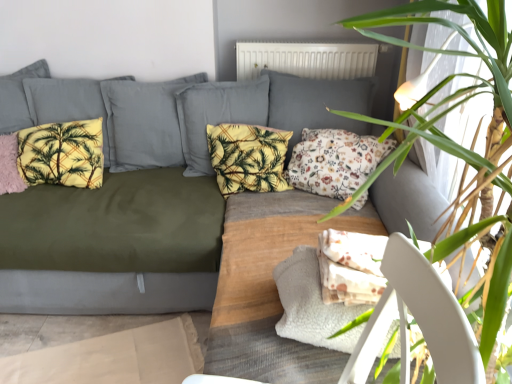
Question: Looking at their shapes, would you say white matte radiator at upper center is wider or thinner than floral fabric pillow at center, arranged as the fourth pillow when viewed from the left?

Choices:
 (A) wide
 (B) thin

Answer: (B)

Question: Is white matte radiator at upper center in front of or behind floral fabric pillow at center, arranged as the fourth pillow when viewed from the left, in the image?

Choices:
 (A) behind
 (B) front

Answer: (A)

Question: Which of these objects is positioned closest to the green leafy plant at upper right?

Choices:
 (A) yellow fabric pillow at center, marked as the second pillow in a right-to-left arrangement
 (B) yellow fleece pillow at left, the second pillow viewed from the left
 (C) floral fabric pillow at center, acting as the 1th pillow starting from the right
 (D) white matte radiator at upper center
 (E) olive-green fabric couch at center

Answer: (C)

Question: Based on their relative distances, which object is nearer to the floral fabric pillow at center, arranged as the fourth pillow when viewed from the left?

Choices:
 (A) pink fluffy pillow at left, placed as the 1th pillow when sorted from left to right
 (B) olive-green fabric couch at center
 (C) white matte radiator at upper center
 (D) yellow fleece pillow at left, the second pillow viewed from the left
 (E) green leafy plant at upper right

Answer: (B)